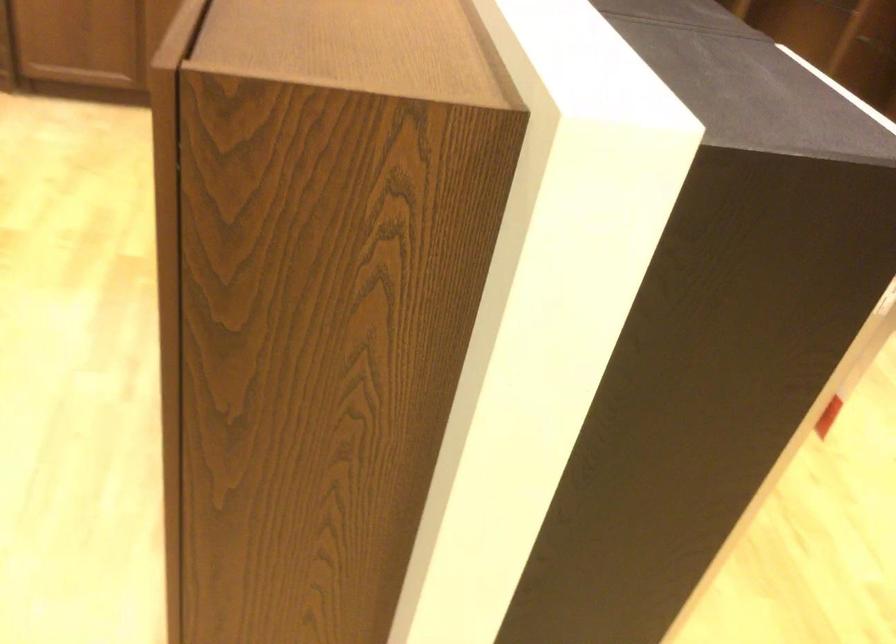
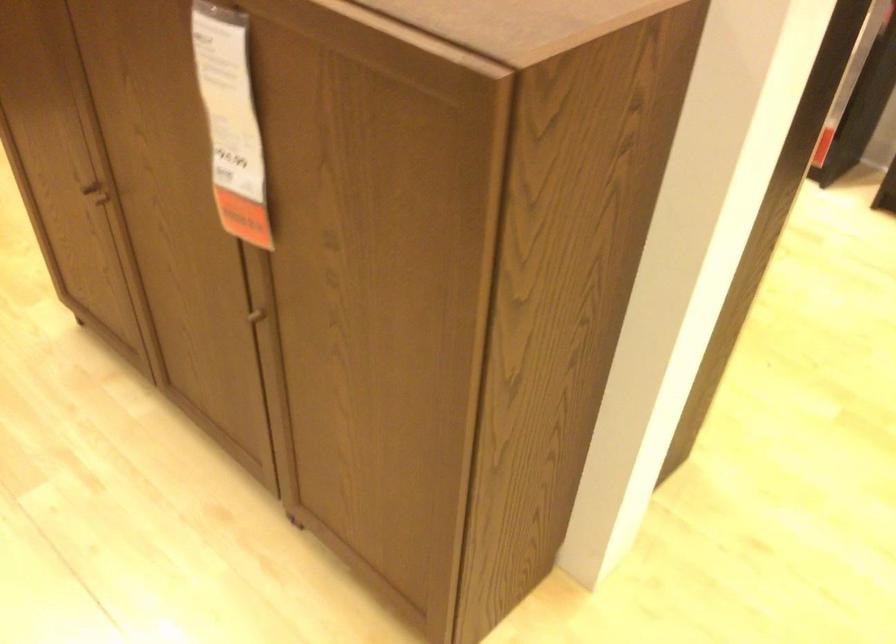
The images are taken continuously from a first-person perspective. In which direction is your viewpoint rotating?

The camera's rotation is toward right-down.